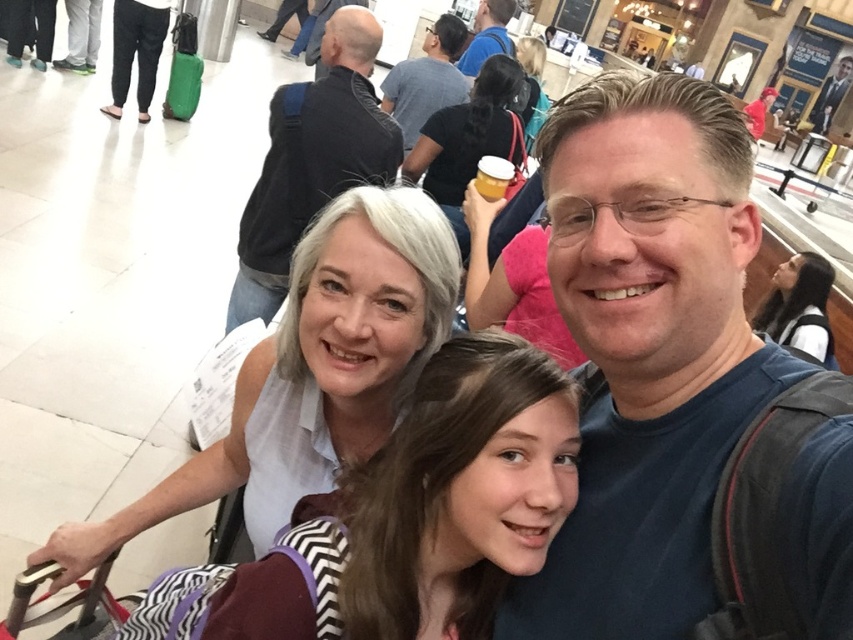
Question: Can you confirm if matte black coffee cup at upper center is positioned above blonde hair at upper center?

Choices:
 (A) yes
 (B) no

Answer: (B)

Question: Which of the following is the closest to the observer?

Choices:
 (A) dark blue t-shirt at center
 (B) white matte shirt at center

Answer: (A)

Question: Can you confirm if white matte shirt at center is wider than dark gray shirt at upper center?

Choices:
 (A) no
 (B) yes

Answer: (B)

Question: Which of the following is the closest to the observer?

Choices:
 (A) (358, 512)
 (B) (373, 344)
 (C) (804, 490)

Answer: (C)

Question: Can you confirm if matte black coffee cup at upper center is thinner than blonde hair at upper center?

Choices:
 (A) yes
 (B) no

Answer: (B)

Question: Which point is farther to the camera?

Choices:
 (A) (773, 336)
 (B) (515, 54)
 (C) (508, 49)

Answer: (C)